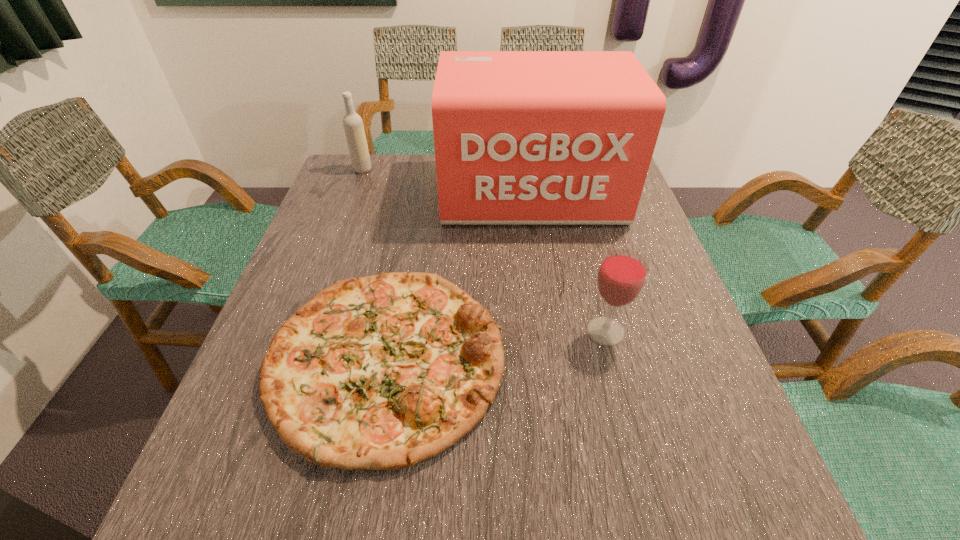
The image size is (960, 540). In order to click on the tallest object in this screenshot , I will do `click(521, 137)`.

This screenshot has height=540, width=960. I want to click on vodka, so (354, 130).

Where is `wineglass`? wineglass is located at coordinates (622, 274).

Locate an element on the screen. The height and width of the screenshot is (540, 960). the shortest object is located at coordinates (382, 372).

Image resolution: width=960 pixels, height=540 pixels. What are the coordinates of `vacant space positioned 0.100m on the surface of the box where the text is embossed` in the screenshot? It's located at coord(540,256).

Identify the location of blank space located on the right of the second tallest object. Image resolution: width=960 pixels, height=540 pixels. (479, 170).

The width and height of the screenshot is (960, 540). I want to click on vacant region located 0.070m on the left of the wineglass, so click(550, 332).

Locate an element on the screen. This screenshot has height=540, width=960. vacant space situated 0.390m on the back of the shortest object is located at coordinates (419, 187).

Image resolution: width=960 pixels, height=540 pixels. What are the coordinates of `box present at the far edge` in the screenshot? It's located at (521, 137).

This screenshot has height=540, width=960. I want to click on vodka that is at the far edge, so click(x=354, y=130).